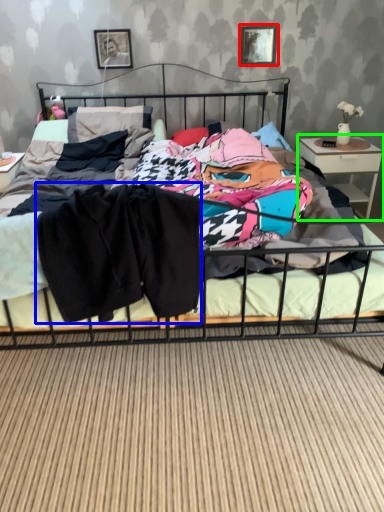
Question: Which is farther away from picture frame (highlighted by a red box)? clothing (highlighted by a blue box) or nightstand (highlighted by a green box)?

Choices:
 (A) clothing
 (B) nightstand

Answer: (A)